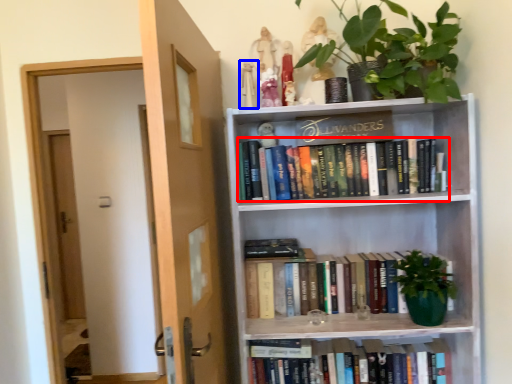
Question: Which object is further to the camera taking this photo, book (highlighted by a red box) or toy (highlighted by a blue box)?

Choices:
 (A) book
 (B) toy

Answer: (A)